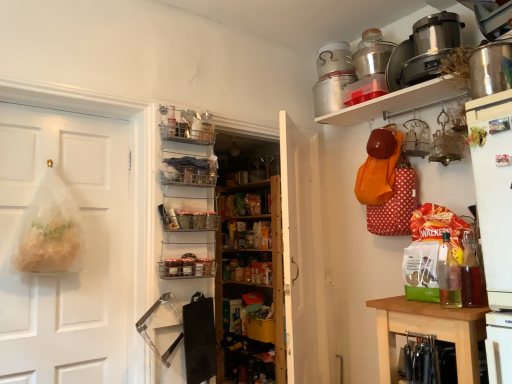
Question: Considering the relative sizes of shiny metallic pot at upper right, placed as the second appliance when sorted from front to back, and metallic silver pot at upper right, the 5th appliance from the bottom, in the image provided, is shiny metallic pot at upper right, placed as the second appliance when sorted from front to back, taller than metallic silver pot at upper right, the 5th appliance from the bottom,?

Choices:
 (A) yes
 (B) no

Answer: (A)

Question: From the image's perspective, is shiny metallic pot at upper right, the 4th appliance positioned from the top, above metallic silver pot at upper right, which appears as the first appliance when viewed from the back?

Choices:
 (A) yes
 (B) no

Answer: (B)

Question: Is the surface of shiny metallic pot at upper right, the 4th appliance positioned from the top, in direct contact with metallic silver pot at upper right, which appears as the first appliance when viewed from the back?

Choices:
 (A) no
 (B) yes

Answer: (A)

Question: Would you consider shiny metallic pot at upper right, the 4th appliance positioned from the top, to be distant from metallic silver pot at upper right, which appears as the first appliance when viewed from the back?

Choices:
 (A) no
 (B) yes

Answer: (B)

Question: From the image's perspective, does shiny metallic pot at upper right, arranged as the 4th appliance when viewed from the back, appear lower than metallic silver pot at upper right, positioned as the 1th appliance in top-to-bottom order?

Choices:
 (A) no
 (B) yes

Answer: (B)

Question: Would you say metallic silver pot at upper right, the 5th appliance from the bottom, is part of shiny metallic pot at upper right, the 4th appliance positioned from the top,'s contents?

Choices:
 (A) no
 (B) yes

Answer: (A)

Question: Is clear plastic bag at left, which ranks as the second door in right-to-left order, to the left of metallic wire basket at center, which is the second shelf from top to bottom, from the viewer's perspective?

Choices:
 (A) yes
 (B) no

Answer: (A)

Question: Is metallic wire basket at center, the first shelf ordered from the bottom, inside clear plastic bag at left, the first door in the left-to-right sequence?

Choices:
 (A) yes
 (B) no

Answer: (B)

Question: Is there a large distance between clear plastic bag at left, which ranks as the second door in right-to-left order, and metallic wire basket at center, which is the second shelf from top to bottom?

Choices:
 (A) yes
 (B) no

Answer: (B)

Question: From a real-world perspective, is clear plastic bag at left, the first door in the left-to-right sequence, physically below metallic wire basket at center, which is the second shelf from top to bottom?

Choices:
 (A) yes
 (B) no

Answer: (B)

Question: Is clear plastic bag at left, which ranks as the second door in right-to-left order, smaller than metallic wire basket at center, which is the second shelf from top to bottom?

Choices:
 (A) yes
 (B) no

Answer: (B)

Question: From the image's perspective, would you say clear plastic bag at left, the first door in the left-to-right sequence, is shown under metallic wire basket at center, which is the second shelf from top to bottom?

Choices:
 (A) yes
 (B) no

Answer: (B)

Question: From a real-world perspective, does shiny metallic pot at upper right, arranged as the 4th appliance when viewed from the back, stand above wooden knife block at lower right?

Choices:
 (A) no
 (B) yes

Answer: (B)